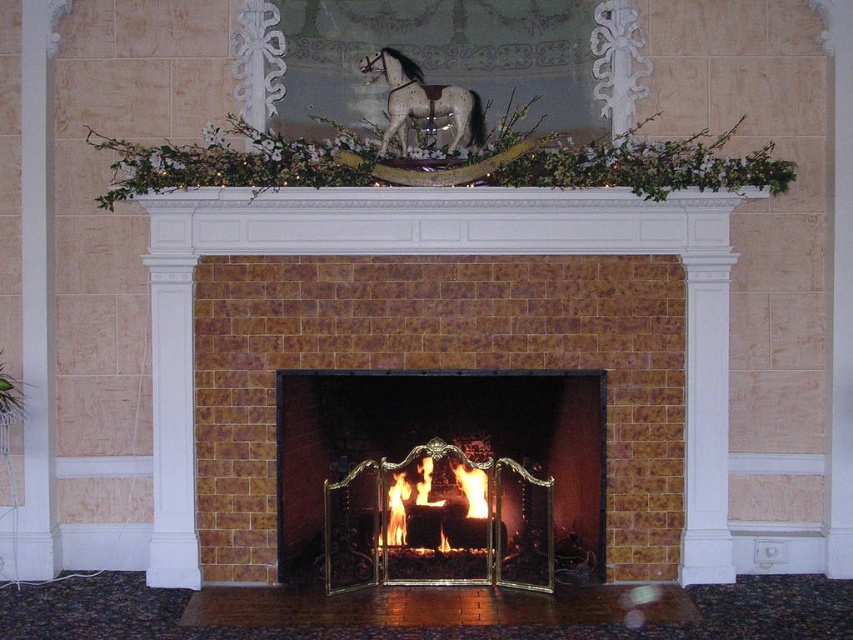
Who is shorter, brown brick fireplace at center or speckled gray horse at upper center?

Standing shorter between the two is speckled gray horse at upper center.

Between brown brick fireplace at center and speckled gray horse at upper center, which one appears on the right side from the viewer's perspective?

brown brick fireplace at center is more to the right.

Which is behind, point (689, 193) or point (454, 84)?

The point (454, 84) is behind.

This screenshot has width=853, height=640. In order to click on brown brick fireplace at center in this screenshot , I will do `click(408, 356)`.

Does brass fireplace screen at center have a lesser height compared to flaming wood at center?

In fact, brass fireplace screen at center may be taller than flaming wood at center.

Does brass fireplace screen at center have a greater height compared to flaming wood at center?

Indeed, brass fireplace screen at center has a greater height compared to flaming wood at center.

This screenshot has height=640, width=853. In order to click on brass fireplace screen at center in this screenshot , I will do `click(440, 477)`.

This screenshot has width=853, height=640. I want to click on brass fireplace screen at center, so click(x=440, y=477).

Can you confirm if brown brick fireplace at center is taller than brass fireplace screen at center?

Correct, brown brick fireplace at center is much taller as brass fireplace screen at center.

Image resolution: width=853 pixels, height=640 pixels. What do you see at coordinates (408, 356) in the screenshot?
I see `brown brick fireplace at center` at bounding box center [408, 356].

Between point (345, 214) and point (445, 438), which one is positioned behind?

Positioned behind is point (445, 438).

At what (x,y) coordinates should I click in order to perform the action: click on brown brick fireplace at center. Please return your answer as a coordinate pair (x, y). The image size is (853, 640). Looking at the image, I should click on click(x=408, y=356).